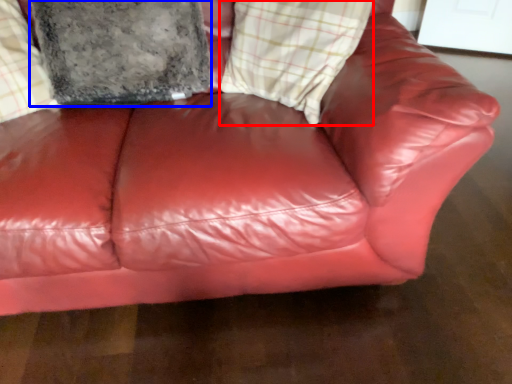
Question: Which object appears closest to the camera in this image, plaid (highlighted by a red box) or pillow (highlighted by a blue box)?

Choices:
 (A) plaid
 (B) pillow

Answer: (A)